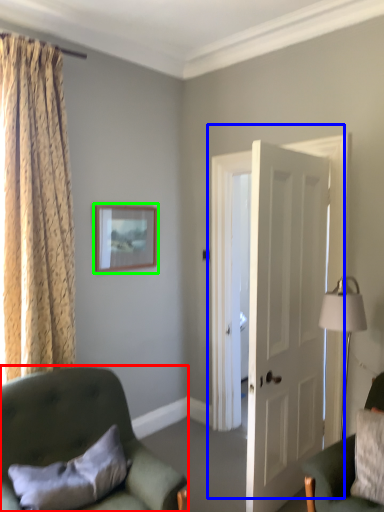
Question: Which is nearer to the chair (highlighted by a red box)? door (highlighted by a blue box) or picture frame (highlighted by a green box).

Choices:
 (A) door
 (B) picture frame

Answer: (B)